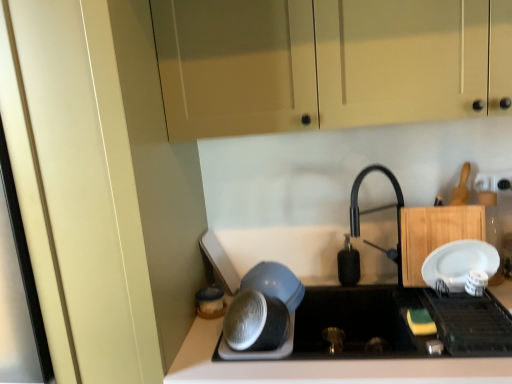
At what (x,y) coordinates should I click in order to perform the action: click on free point behind matte plastic container at lower center, marked as the third appliance in a front-to-back arrangement. Please return your answer as a coordinate pair (x, y). Looking at the image, I should click on (223, 294).